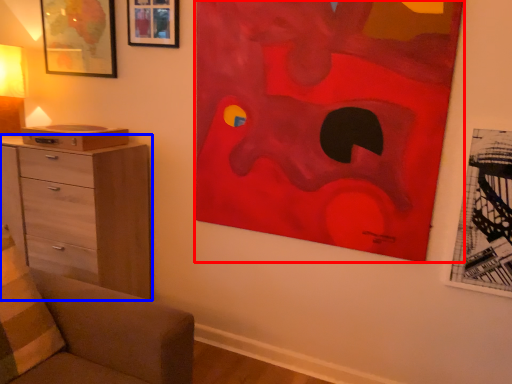
Question: Which object is closer to the camera taking this photo, art (highlighted by a red box) or chest of drawers (highlighted by a blue box)?

Choices:
 (A) art
 (B) chest of drawers

Answer: (A)